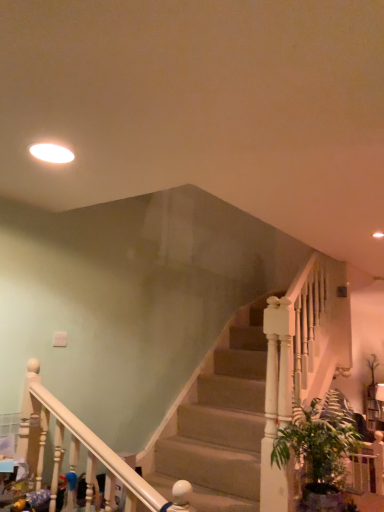
Question: In the image, is white glossy light fixture at upper left positioned in front of or behind green leafy plant at lower right?

Choices:
 (A) behind
 (B) front

Answer: (B)

Question: From the image's perspective, is white glossy light fixture at upper left above or below green leafy plant at lower right?

Choices:
 (A) above
 (B) below

Answer: (A)

Question: Would you say white glossy light fixture at upper left is inside or outside green leafy plant at lower right?

Choices:
 (A) inside
 (B) outside

Answer: (B)

Question: From a real-world perspective, is green leafy plant at lower right above or below white glossy light fixture at upper left?

Choices:
 (A) above
 (B) below

Answer: (B)

Question: Looking at their shapes, would you say green leafy plant at lower right is wider or thinner than white glossy light fixture at upper left?

Choices:
 (A) wide
 (B) thin

Answer: (A)

Question: From the image's perspective, is green leafy plant at lower right above or below white glossy light fixture at upper left?

Choices:
 (A) above
 (B) below

Answer: (B)

Question: Looking at the image, does green leafy plant at lower right seem bigger or smaller compared to white glossy light fixture at upper left?

Choices:
 (A) big
 (B) small

Answer: (A)